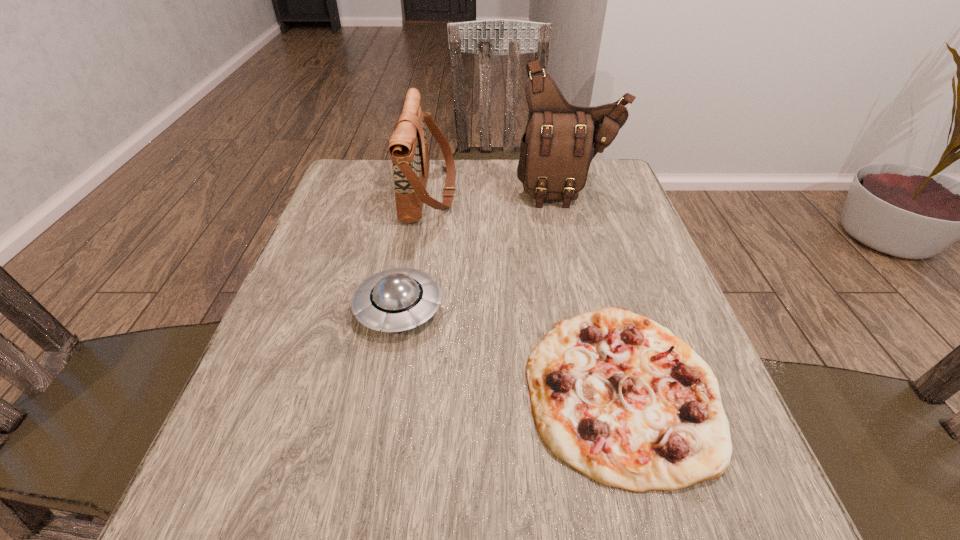
Locate an element on the screen. Image resolution: width=960 pixels, height=540 pixels. free space between the tallest object and the pizza is located at coordinates (595, 290).

At what (x,y) coordinates should I click in order to perform the action: click on empty space between the shortest object and the right shoulder bag. Please return your answer as a coordinate pair (x, y). Image resolution: width=960 pixels, height=540 pixels. Looking at the image, I should click on (595, 290).

You are a GUI agent. You are given a task and a screenshot of the screen. Output one action in this format:
    pyautogui.click(x=<x>, y=<y>)
    Task: Click on the vacant region between the shortest object and the tallest object
    
    Given the screenshot: What is the action you would take?
    pyautogui.click(x=595, y=290)

You are a GUI agent. You are given a task and a screenshot of the screen. Output one action in this format:
    pyautogui.click(x=<x>, y=<y>)
    Task: Click on the free space between the shortest object and the left shoulder bag
    Image resolution: width=960 pixels, height=540 pixels.
    Given the screenshot: What is the action you would take?
    pyautogui.click(x=526, y=290)

Point out which object is positioned as the second nearest to the saucer. Please provide its 2D coordinates. Your answer should be formatted as a tuple, i.e. [(x, y)], where the tuple contains the x and y coordinates of a point satisfying the conditions above.

[(408, 147)]

At what (x,y) coordinates should I click in order to perform the action: click on the third closest object to the left shoulder bag. Please return your answer as a coordinate pair (x, y). The image size is (960, 540). Looking at the image, I should click on (618, 397).

You are a GUI agent. You are given a task and a screenshot of the screen. Output one action in this format:
    pyautogui.click(x=<x>, y=<y>)
    Task: Click on the free space in the image that satisfies the following two spatial constraints: 1. on the front-facing side of the pizza; 2. on the left side of the right shoulder bag
    This screenshot has width=960, height=540.
    Given the screenshot: What is the action you would take?
    pyautogui.click(x=621, y=389)

Find the location of a particular element. free space that satisfies the following two spatial constraints: 1. on the front-facing side of the right shoulder bag; 2. on the front-facing side of the left shoulder bag is located at coordinates (568, 192).

Image resolution: width=960 pixels, height=540 pixels. What are the coordinates of `free location that satisfies the following two spatial constraints: 1. on the front-facing side of the left shoulder bag; 2. on the right side of the pizza` in the screenshot? It's located at (399, 389).

The image size is (960, 540). I want to click on vacant region that satisfies the following two spatial constraints: 1. on the front-facing side of the shorter shoulder bag; 2. on the left side of the shortest object, so click(x=399, y=389).